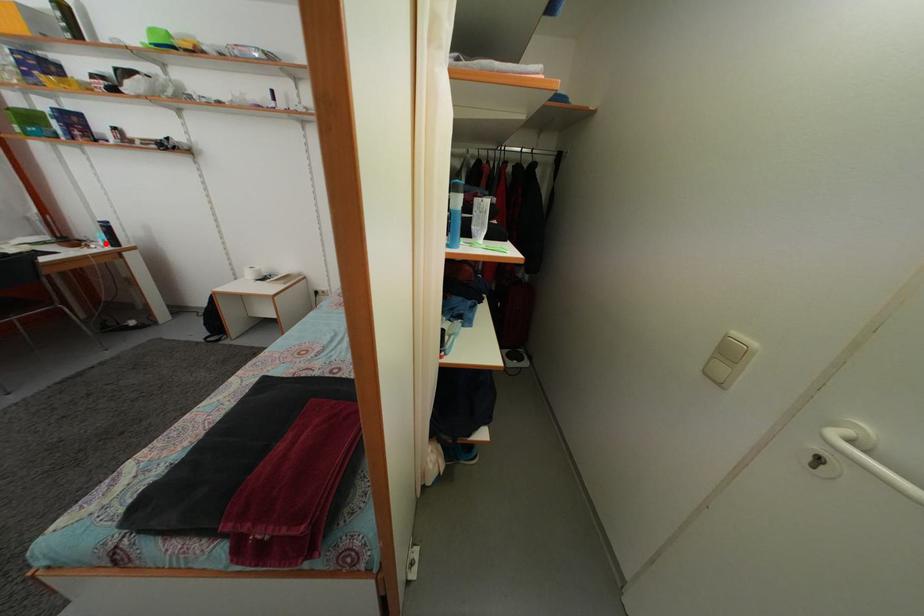
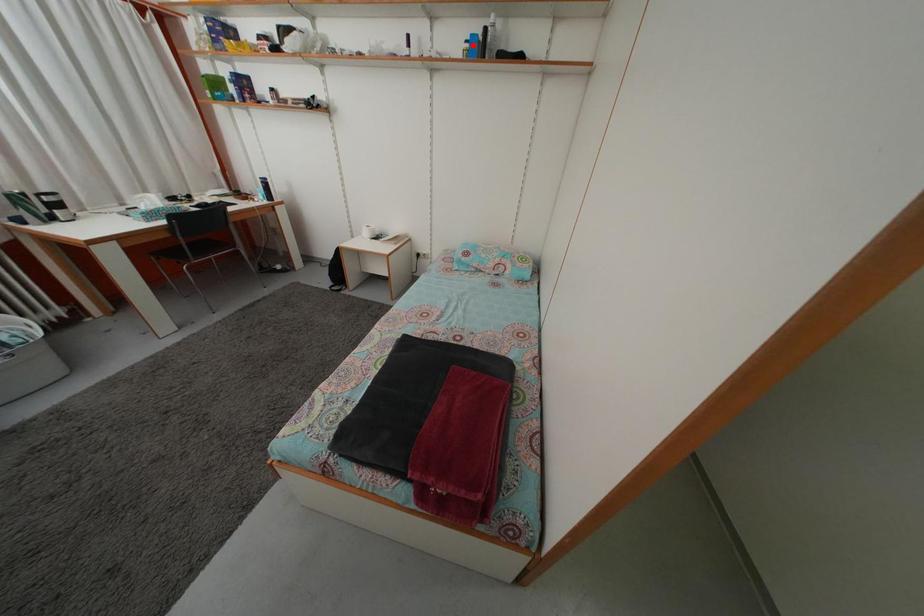
Looking at this image, I am providing you with two images of the same scene from different viewpoints. A red point is marked on the first image and another point is marked on the second image. Is the red point in image1 aligned with the point shown in image2?

No